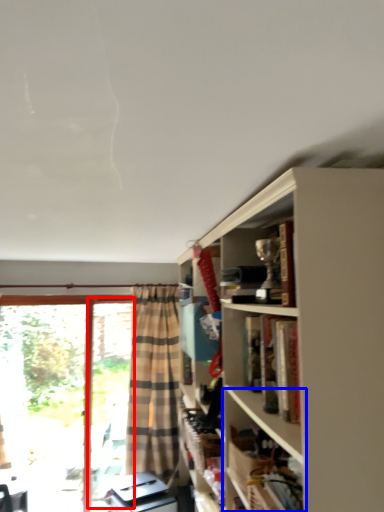
Question: Among these objects, which one is farthest to the camera, screen door (highlighted by a red box) or shelf (highlighted by a blue box)?

Choices:
 (A) screen door
 (B) shelf

Answer: (A)